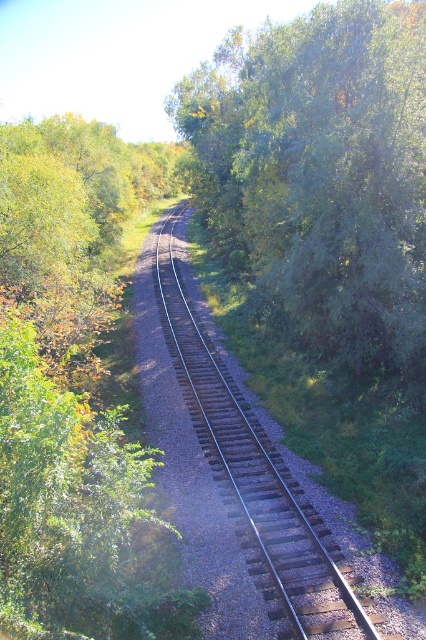
You are standing at the starting point of the railway track and want to place a bench so that it is directly in front of the green leafy tree at center. Given the coordinates provided, can you determine if the bench will be positioned along the railway track?

The green leafy tree at center is located at point (321,179). Since the railway track runs along the center of the image, the bench placed directly in front of the tree would be positioned along the railway track.

You are standing at the edge of the railway track and want to walk towards the green leafy tree at center and the brown gravel track at center. Which object will you encounter first as you walk forward?

You will encounter the green leafy tree at center first because it is closer to you than the brown gravel track at center, which is further away.